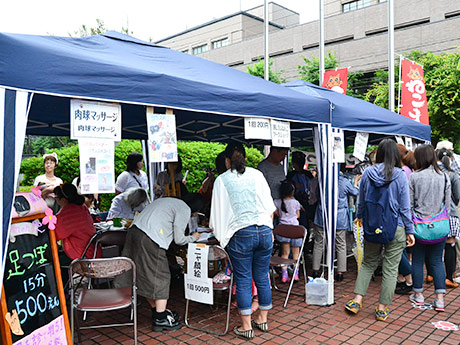
The width and height of the screenshot is (460, 345). Find the location of `navy blue canopy`. navy blue canopy is located at coordinates (135, 75), (372, 112).